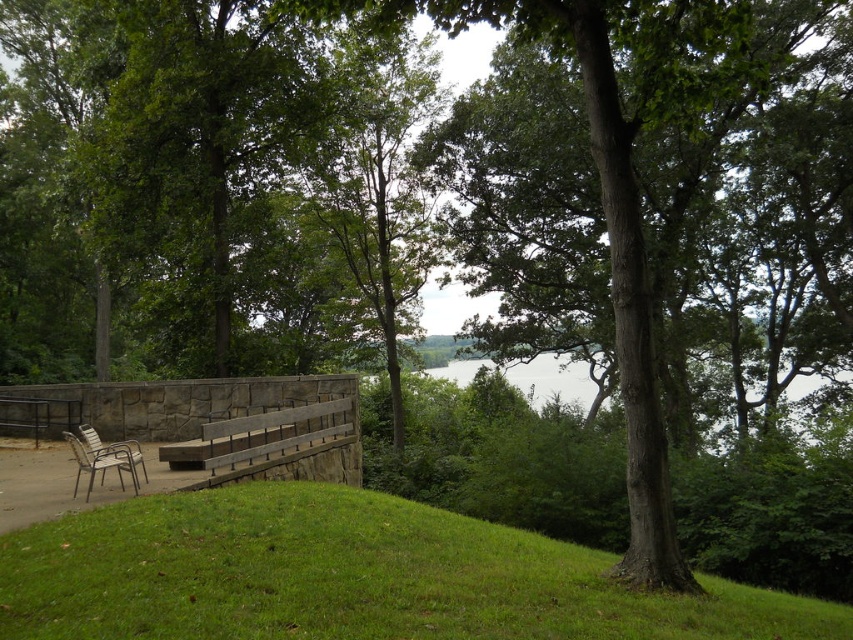
Which is more to the right, green rough bark tree at center or metallic silver chair at lower left?

green rough bark tree at center

Which is above, green rough bark tree at center or metallic silver chair at lower left?

green rough bark tree at center

Is point (637, 214) closer to camera compared to point (144, 474)?

That is True.

At what (x,y) coordinates should I click in order to perform the action: click on green rough bark tree at center. Please return your answer as a coordinate pair (x, y). Looking at the image, I should click on (646, 193).

Can you confirm if green grassy hillside at lower left is taller than metallic silver chair at lower left?

Incorrect, green grassy hillside at lower left's height is not larger of metallic silver chair at lower left's.

Which is above, green grassy hillside at lower left or metallic silver chair at lower left?

green grassy hillside at lower left is above.

Identify the location of green grassy hillside at lower left. Image resolution: width=853 pixels, height=640 pixels. (347, 577).

Is green grassy hillside at lower left wider than brown wooden bench at center?

In fact, green grassy hillside at lower left might be narrower than brown wooden bench at center.

Measure the distance from green grassy hillside at lower left to brown wooden bench at center.

17.35 feet

Between point (558, 604) and point (350, 400), which one is positioned behind?

Point (350, 400)

The image size is (853, 640). In order to click on green grassy hillside at lower left in this screenshot , I will do `click(347, 577)`.